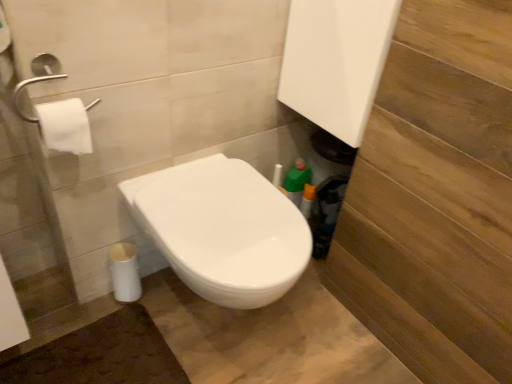
This screenshot has height=384, width=512. Find the location of `vacant space underneath white glossy toilet at center (from a real-world perspective)`. vacant space underneath white glossy toilet at center (from a real-world perspective) is located at coordinates (212, 323).